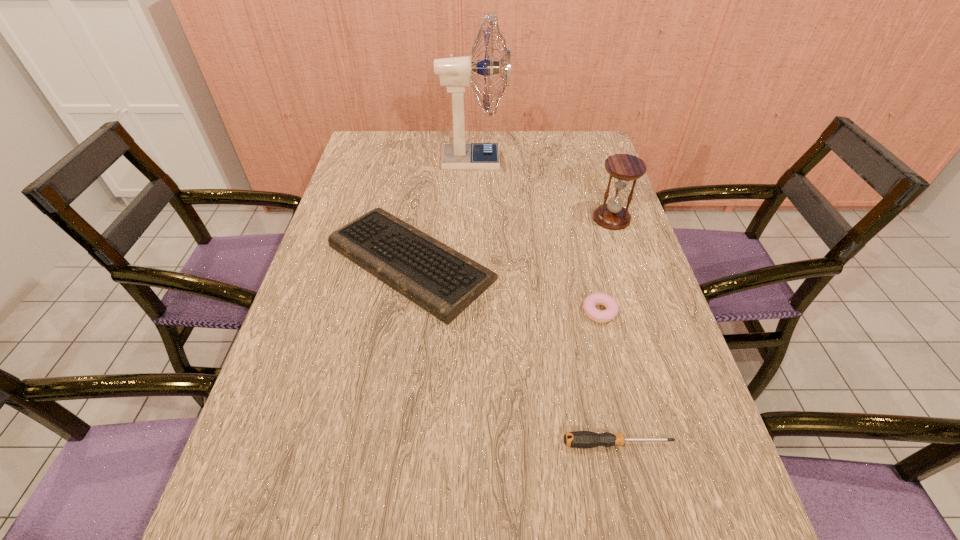
This screenshot has width=960, height=540. Find the location of `vacant area at the far right corner of the desktop`. vacant area at the far right corner of the desktop is located at coordinates (573, 143).

This screenshot has width=960, height=540. What are the coordinates of `free space that is in between the hourglass and the screwdriver` in the screenshot? It's located at (614, 331).

The height and width of the screenshot is (540, 960). In order to click on free space between the computer keyboard and the hourglass in this screenshot , I will do `click(512, 241)`.

Find the location of a particular element. Image resolution: width=960 pixels, height=540 pixels. free spot between the nearest object and the third shortest object is located at coordinates (514, 353).

Locate an element on the screen. The image size is (960, 540). vacant area that lies between the third tallest object and the nearest object is located at coordinates (514, 353).

Identify the location of vacant space that's between the third shortest object and the fourth shortest object. The width and height of the screenshot is (960, 540). (512, 241).

Where is `free space between the third shortest object and the fourth shortest object`? free space between the third shortest object and the fourth shortest object is located at coordinates (512, 241).

At what (x,y) coordinates should I click in order to perform the action: click on free spot between the doughnut and the hourglass. Please return your answer as a coordinate pair (x, y). The height and width of the screenshot is (540, 960). Looking at the image, I should click on (606, 266).

The image size is (960, 540). Identify the location of object that is the closest one to the farthest object. (444, 282).

Identify the location of object that is the second nearest to the nearest object. (444, 282).